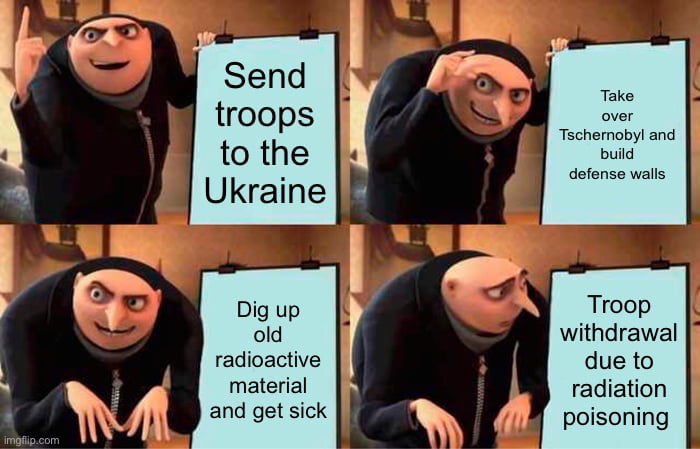
Identify the location of tan wall. (178, 16), (504, 15), (190, 253), (526, 241).